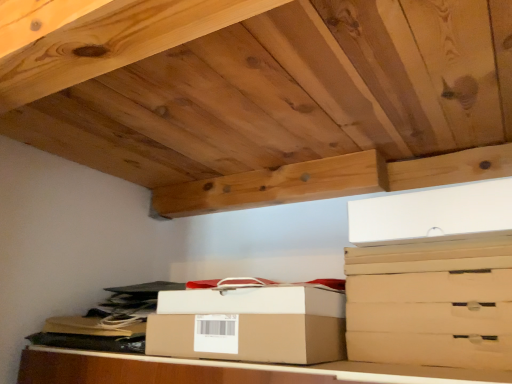
Question: Which direction should I rotate to look at white cardboard box at center, positioned as the 2th box in bottom-to-top order?

Choices:
 (A) right
 (B) left

Answer: (B)

Question: From the image's perspective, is matte cardboard drawer at lower right, the second drawer when ordered from bottom to top, above brown cardboard box at center?

Choices:
 (A) no
 (B) yes

Answer: (B)

Question: Is matte cardboard drawer at lower right, the second drawer when ordered from bottom to top, not inside brown cardboard box at center?

Choices:
 (A) yes
 (B) no

Answer: (A)

Question: Is matte cardboard drawer at lower right, the second drawer when ordered from bottom to top, far from brown cardboard box at center?

Choices:
 (A) no
 (B) yes

Answer: (A)

Question: Is matte cardboard drawer at lower right, the third drawer viewed from the top, further to the viewer compared to brown cardboard box at center?

Choices:
 (A) no
 (B) yes

Answer: (B)

Question: Can you confirm if matte cardboard drawer at lower right, the second drawer when ordered from bottom to top, is shorter than brown cardboard box at center?

Choices:
 (A) no
 (B) yes

Answer: (B)

Question: Is matte cardboard drawer at lower right, the third drawer viewed from the top, to the right of brown cardboard box at center from the viewer's perspective?

Choices:
 (A) no
 (B) yes

Answer: (B)

Question: From a real-world perspective, is brown cardboard drawer at lower right, arranged as the 1th drawer when ordered from the bottom, positioned over brown cardboard box at center based on gravity?

Choices:
 (A) yes
 (B) no

Answer: (A)

Question: Can you see brown cardboard drawer at lower right, which is the 4th drawer in top-to-bottom order, touching brown cardboard box at center?

Choices:
 (A) yes
 (B) no

Answer: (B)

Question: Is brown cardboard drawer at lower right, which is the 4th drawer in top-to-bottom order, oriented towards brown cardboard box at center?

Choices:
 (A) yes
 (B) no

Answer: (B)

Question: Is brown cardboard drawer at lower right, which is the 4th drawer in top-to-bottom order, in front of brown cardboard box at center?

Choices:
 (A) no
 (B) yes

Answer: (A)

Question: Does brown cardboard drawer at lower right, which is the 4th drawer in top-to-bottom order, have a lesser height compared to brown cardboard box at center?

Choices:
 (A) yes
 (B) no

Answer: (A)

Question: Would you say brown cardboard drawer at lower right, arranged as the 1th drawer when ordered from the bottom, is outside brown cardboard box at center?

Choices:
 (A) no
 (B) yes

Answer: (B)

Question: Considering the relative sizes of brown cardboard drawer at right, acting as the 4th drawer starting from the bottom, and matte cardboard drawer at lower right, the third drawer viewed from the top, in the image provided, is brown cardboard drawer at right, acting as the 4th drawer starting from the bottom, bigger than matte cardboard drawer at lower right, the third drawer viewed from the top,?

Choices:
 (A) no
 (B) yes

Answer: (A)